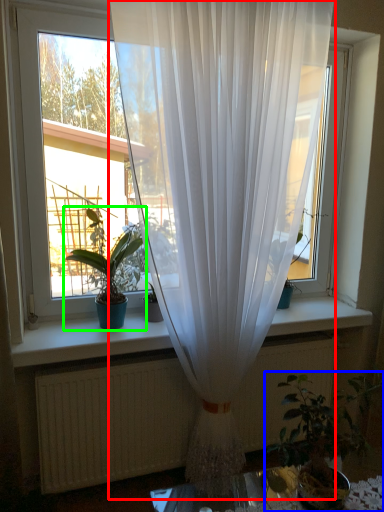
Question: Which is farther away from curtain (highlighted by a red box)? houseplant (highlighted by a blue box) or houseplant (highlighted by a green box)?

Choices:
 (A) houseplant
 (B) houseplant

Answer: (A)